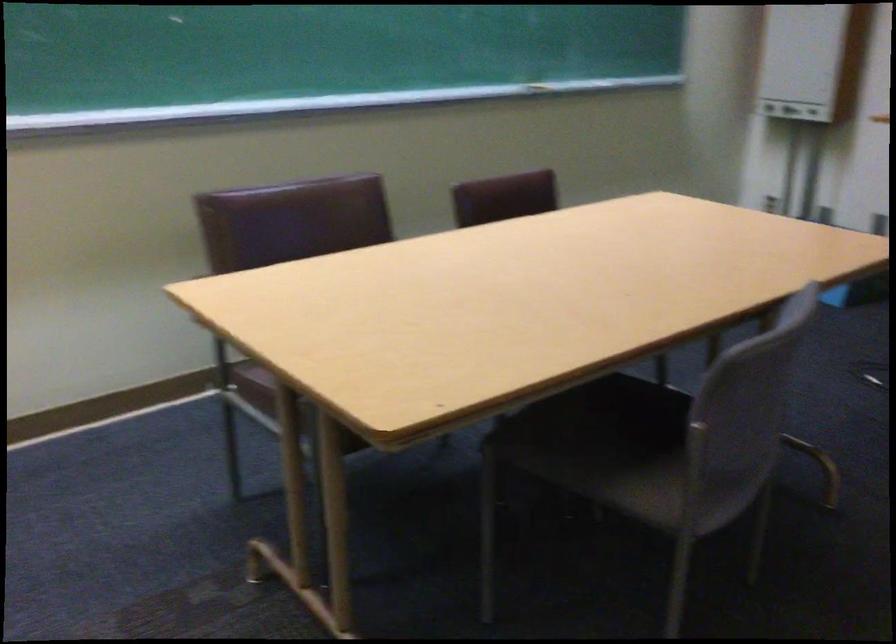
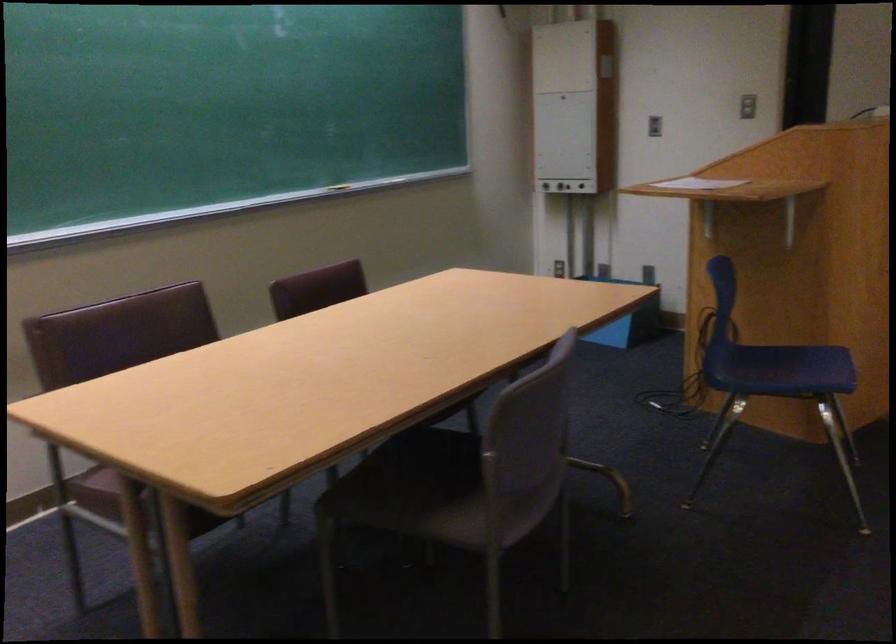
In the second image, find the point that corresponds to pixel 631 444 in the first image.

(454, 487)